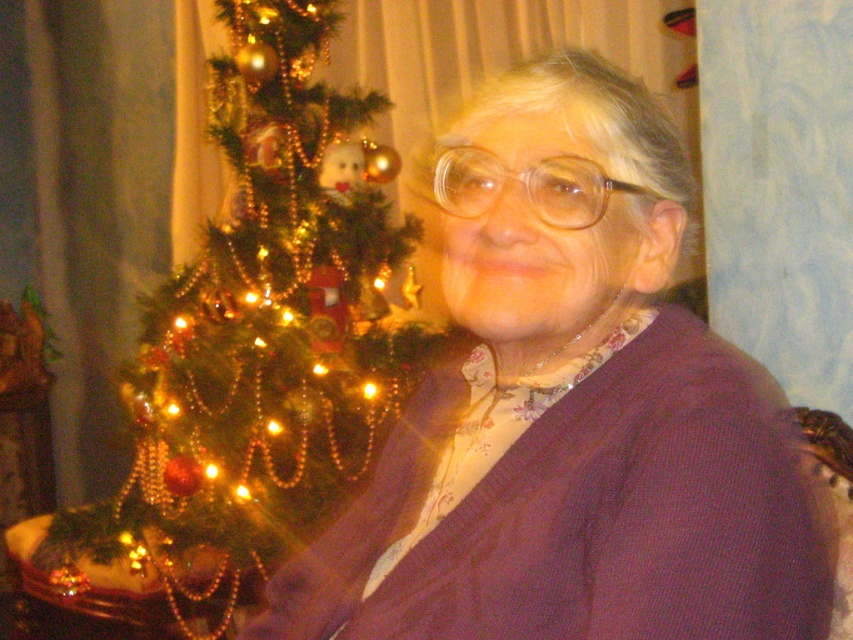
Which is below, purple knitted sweater at center or green textured christmas tree at left?

purple knitted sweater at center is lower down.

Is purple knitted sweater at center above green textured christmas tree at left?

No, purple knitted sweater at center is not above green textured christmas tree at left.

Who is more forward, (575, 232) or (239, 156)?

Point (575, 232) is more forward.

Image resolution: width=853 pixels, height=640 pixels. I want to click on purple knitted sweater at center, so click(x=572, y=413).